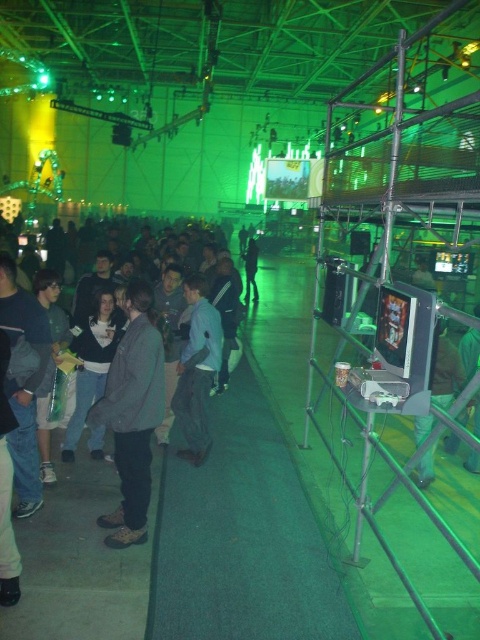
Is light blue denim jacket at center behind dark gray hoodie at center?

No, it is not.

This screenshot has height=640, width=480. What do you see at coordinates (196, 371) in the screenshot?
I see `light blue denim jacket at center` at bounding box center [196, 371].

Between point (204, 385) and point (253, 273), which one is positioned in front?

Point (204, 385) is in front.

Find the location of `light blue denim jacket at center`. light blue denim jacket at center is located at coordinates (196, 371).

From the picture: Between light blue denim jacket at center and green fabric pants at lower right, which one has less height?

Standing shorter between the two is green fabric pants at lower right.

Is point (192, 340) positioned before point (420, 438)?

Yes, it is.

I want to click on light blue denim jacket at center, so click(x=196, y=371).

Can you confirm if gray woolen jacket at center is thinner than green fabric pants at lower right?

Incorrect, gray woolen jacket at center's width is not less than green fabric pants at lower right's.

Is gray woolen jacket at center positioned at the back of green fabric pants at lower right?

No.

Does point (119, 403) lie in front of point (431, 458)?

Yes.

The image size is (480, 640). I want to click on gray woolen jacket at center, so pos(132,416).